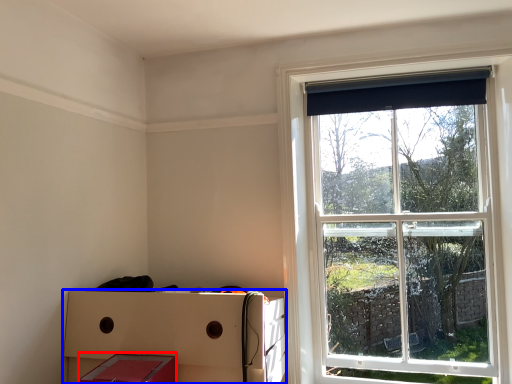
Question: Which point is further to the camera, storage box (highlighted by a red box) or crate (highlighted by a blue box)?

Choices:
 (A) storage box
 (B) crate

Answer: (B)